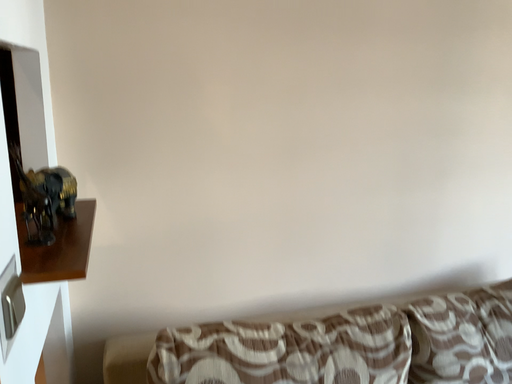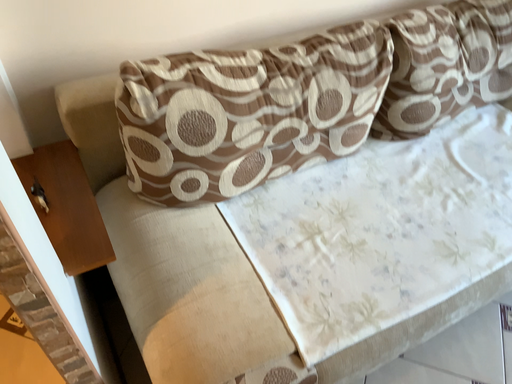
Question: How did the camera likely rotate when shooting the video?

Choices:
 (A) rotated right
 (B) rotated left

Answer: (A)